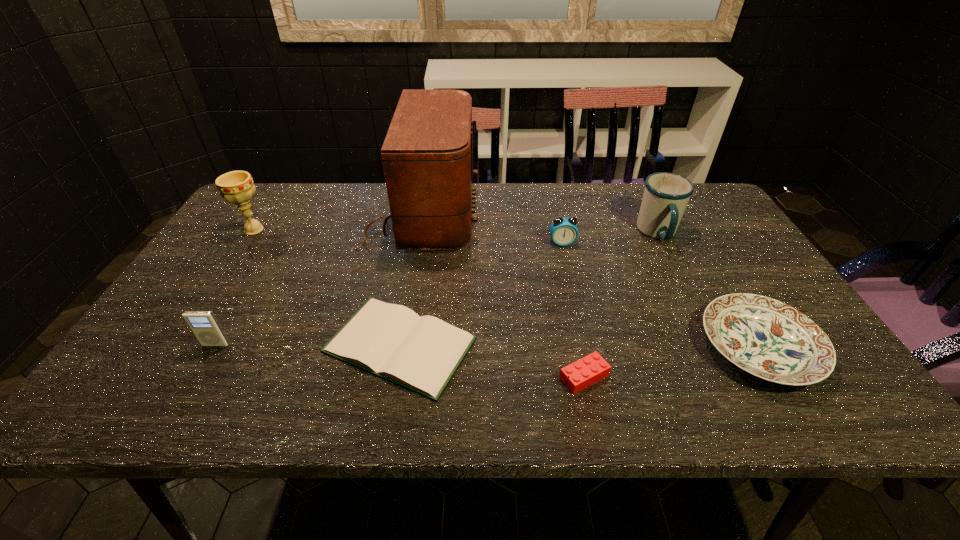
Where is `vacant space at the left edge of the desktop`? Image resolution: width=960 pixels, height=540 pixels. vacant space at the left edge of the desktop is located at coordinates (153, 336).

At what (x,y) coordinates should I click in order to perform the action: click on vacant area at the right edge of the desktop. Please return your answer as a coordinate pair (x, y). The height and width of the screenshot is (540, 960). Looking at the image, I should click on (735, 240).

You are a GUI agent. You are given a task and a screenshot of the screen. Output one action in this format:
    pyautogui.click(x=<x>, y=<y>)
    Task: Click on the blank area at the far left corner
    
    Given the screenshot: What is the action you would take?
    pyautogui.click(x=280, y=219)

The image size is (960, 540). I want to click on vacant space at the far right corner of the desktop, so click(x=708, y=218).

This screenshot has height=540, width=960. I want to click on free space between the fifth tallest object and the plate, so click(660, 295).

This screenshot has height=540, width=960. I want to click on empty location between the leftmost object and the radio receiver, so click(x=338, y=222).

Identify the location of vacant space that is in between the tallest object and the alarm clock. (492, 229).

This screenshot has height=540, width=960. I want to click on vacant point located between the shortest object and the fifth tallest object, so click(x=481, y=294).

Image resolution: width=960 pixels, height=540 pixels. Find the location of `vacant region between the plate and the radio receiver`. vacant region between the plate and the radio receiver is located at coordinates (589, 281).

In order to click on free space between the mug and the tallest object in this screenshot , I will do `click(540, 224)`.